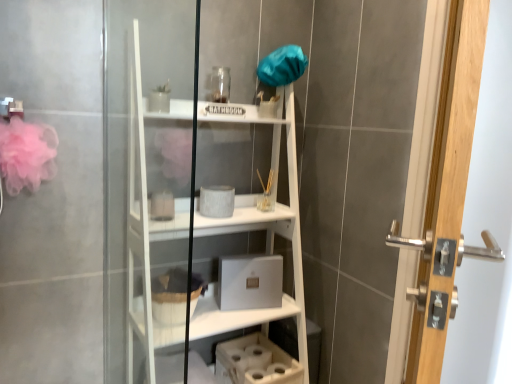
Question: In the image, is white matte bookshelf at center positioned in front of or behind fuzzy fabric basket at lower center?

Choices:
 (A) behind
 (B) front

Answer: (B)

Question: Is white matte bookshelf at center bigger or smaller than fuzzy fabric basket at lower center?

Choices:
 (A) big
 (B) small

Answer: (A)

Question: Considering the real-world distances, which object is farthest from the fuzzy fabric basket at lower center?

Choices:
 (A) polished silver handle at right
 (B) white matte bookshelf at center

Answer: (A)

Question: Which object is the closest to the fuzzy fabric basket at lower center?

Choices:
 (A) polished silver handle at right
 (B) white matte bookshelf at center

Answer: (B)